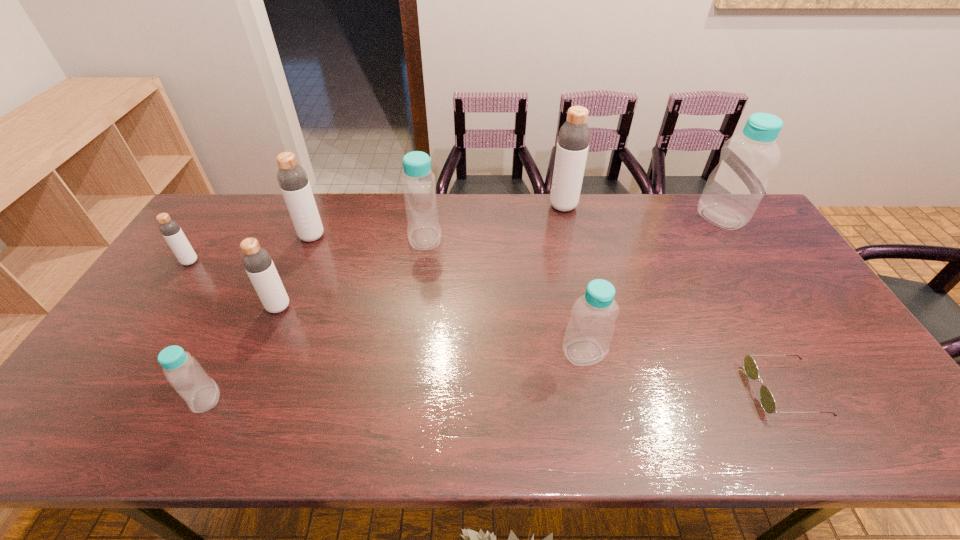
Choose which bottle is the second nearest neighbor to the second smallest blue bottle. Please provide its 2D coordinates. Your answer should be formatted as a tuple, i.e. [(x, y)], where the tuple contains the x and y coordinates of a point satisfying the conditions above.

[(574, 136)]

Point out which bottle is positioned as the nearest to the farthest gray bottle. Please provide its 2D coordinates. Your answer should be formatted as a tuple, i.e. [(x, y)], where the tuple contains the x and y coordinates of a point satisfying the conditions above.

[(418, 182)]

In order to click on gray bottle that is the third nearest to the sixth farthest object in this screenshot , I will do `click(574, 136)`.

Identify the location of the third closest gray bottle to the biggest gray bottle. This screenshot has width=960, height=540. (170, 229).

Find the location of a particular element. Image resolution: width=960 pixels, height=540 pixels. the third closest blue bottle to the seventh farthest bottle is located at coordinates (185, 374).

Point out which blue bottle is positioned as the nearest to the eighth object from right to left. Please provide its 2D coordinates. Your answer should be formatted as a tuple, i.e. [(x, y)], where the tuple contains the x and y coordinates of a point satisfying the conditions above.

[(418, 182)]

Where is `free space that satisfies the following two spatial constraints: 1. on the front-facing side of the green sunglasses; 2. on the front side of the leftmost blue bottle`? The height and width of the screenshot is (540, 960). free space that satisfies the following two spatial constraints: 1. on the front-facing side of the green sunglasses; 2. on the front side of the leftmost blue bottle is located at coordinates (789, 399).